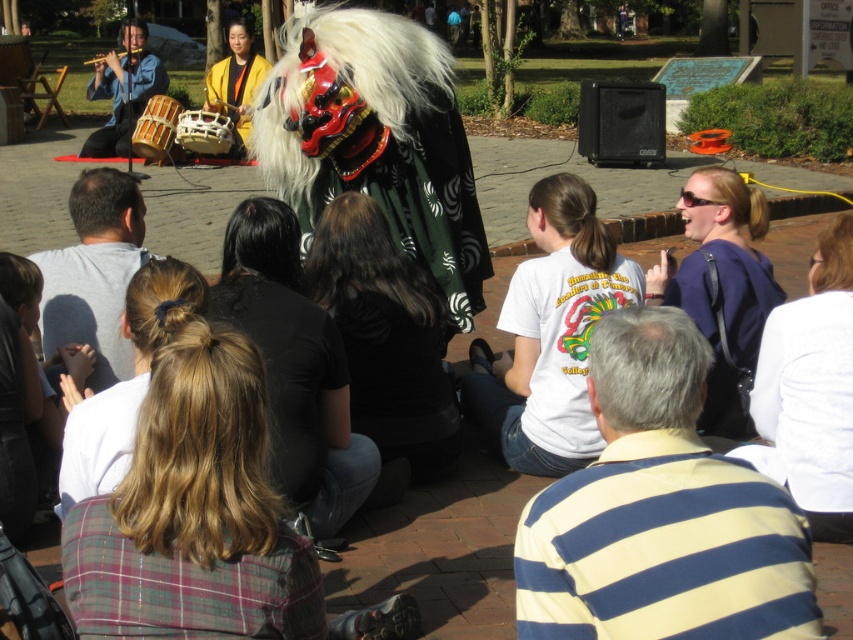
You are a photographer standing at the center of the scene. You want to take a photo that includes both the point at coordinates point (364, 291) and point (129, 52). Since you want to ensure both points are in focus, which point should you focus on to maximize the depth of field?

To maximize the depth of field for both points, you should focus on the point that is closer to the viewer, which is point (364, 291). This ensures that both near and far points are in focus.

You are a photographer trying to capture the performer wearing the black matte mask at center and the brushed metal flute at upper left in the same frame. Based on their sizes, which object should you focus on first to ensure both are in the frame?

The black matte mask at center is taller than the brushed metal flute at upper left, so you should focus on the black matte mask at center first to ensure both are in the frame since it is the larger object.